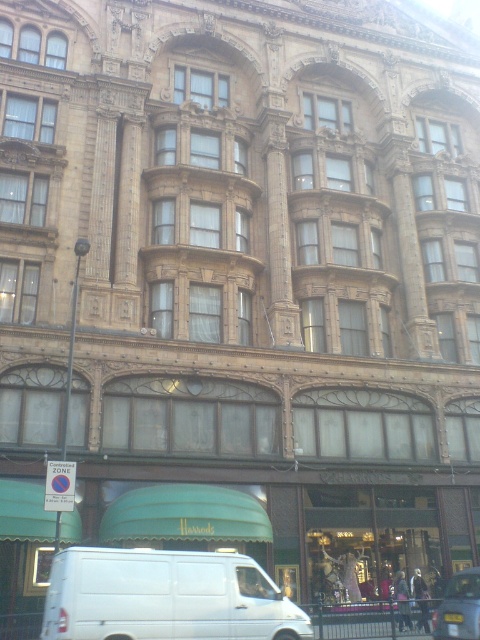
Does point (196, 577) come behind point (469, 579)?

No, it is not.

Which of these two, white matte van at lower center or metallic silver car at lower right, stands shorter?

white matte van at lower center

This screenshot has width=480, height=640. What do you see at coordinates (166, 596) in the screenshot?
I see `white matte van at lower center` at bounding box center [166, 596].

Where is `white matte van at lower center`? The height and width of the screenshot is (640, 480). white matte van at lower center is located at coordinates (166, 596).